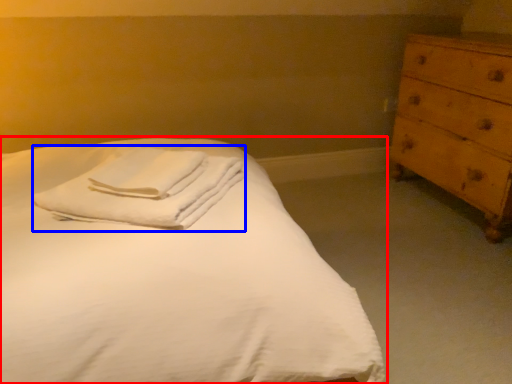
Question: Which object appears closest to the camera in this image, bed (highlighted by a red box) or material (highlighted by a blue box)?

Choices:
 (A) bed
 (B) material

Answer: (A)